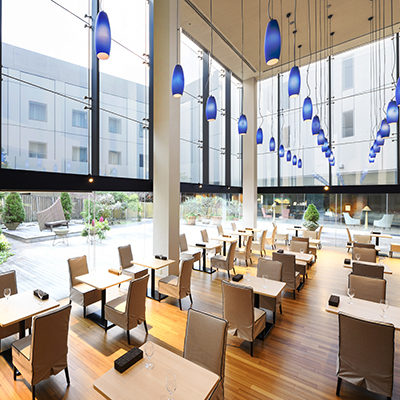
Where is `wine glasses`? wine glasses is located at coordinates (6, 293), (148, 351), (171, 387), (351, 292), (385, 304), (358, 255), (302, 249), (248, 274), (264, 276).